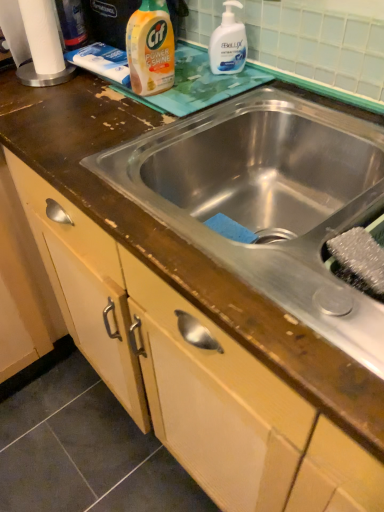
I want to click on vacant space in front of white glossy hand soap at upper right, which ranks as the second cleaning product in left-to-right order, so click(210, 90).